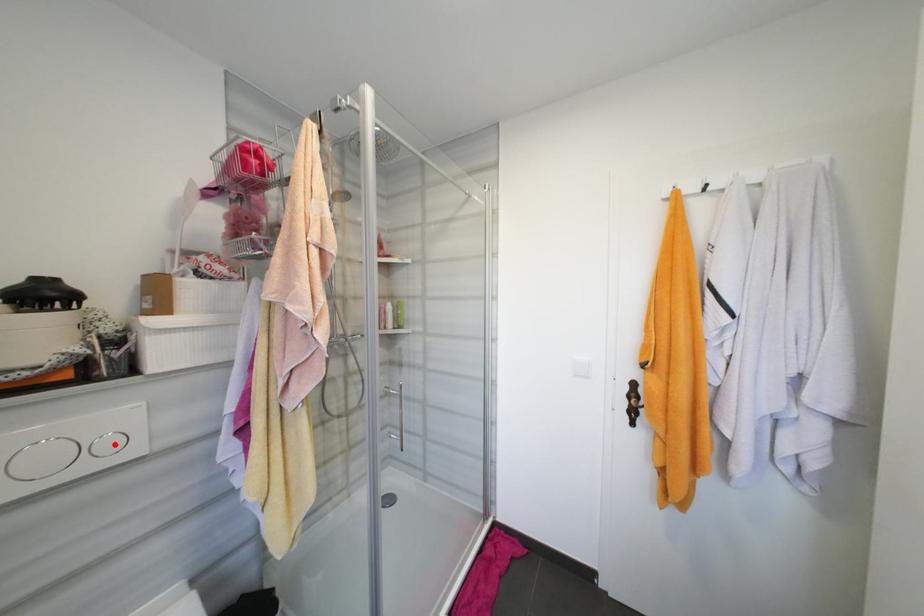
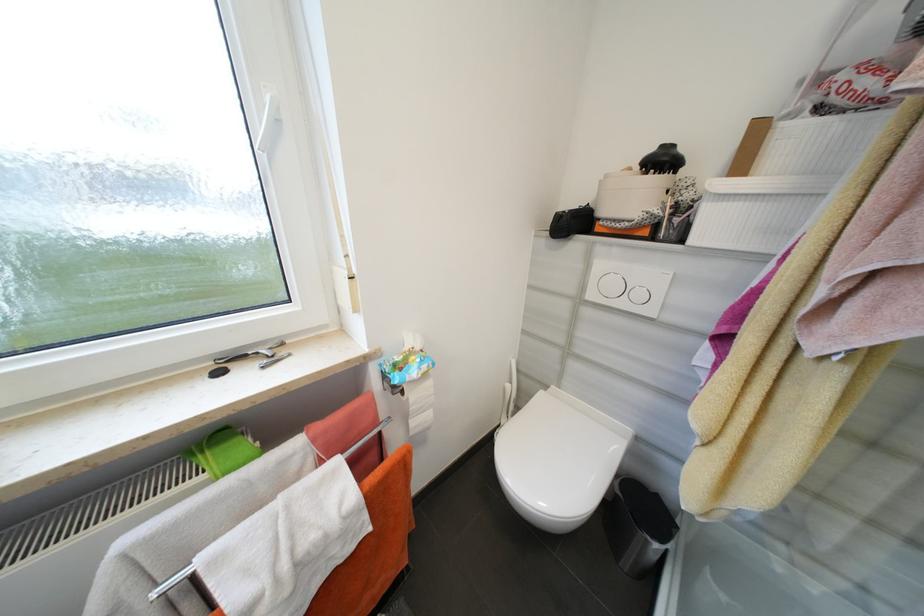
Question: I am providing you with two images of the same scene from different viewpoints. A red point is marked on the first image. At the location where the point appears in image 1, is it still visible in image 2?

Choices:
 (A) Yes
 (B) No

Answer: (A)